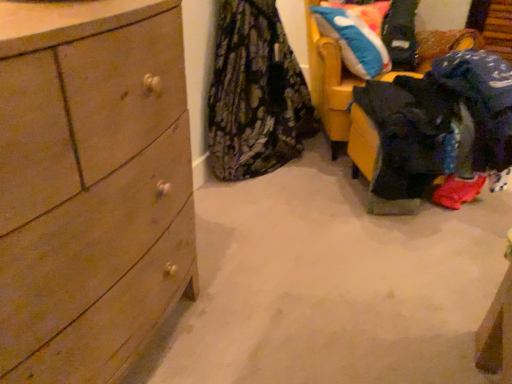
Question: Based on their sizes in the image, would you say dark blue fabric at lower right, the first clothing in the right-to-left sequence, is bigger or smaller than floral fabric skirt at center, the 1th clothing in the left-to-right sequence?

Choices:
 (A) big
 (B) small

Answer: (A)

Question: From the image's perspective, is dark blue fabric at lower right, the first clothing in the right-to-left sequence, above or below floral fabric skirt at center, the 1th clothing in the left-to-right sequence?

Choices:
 (A) above
 (B) below

Answer: (B)

Question: Estimate the real-world distances between objects in this image. Which object is closer to the blue plush pillow at upper right?

Choices:
 (A) wooden dresser at left
 (B) dark blue fabric at lower right, the first clothing in the right-to-left sequence
 (C) floral fabric skirt at center, the 1th clothing in the left-to-right sequence
 (D) yellow fabric chair at upper right

Answer: (D)

Question: Considering the real-world distances, which object is farthest from the dark blue fabric at lower right, which is the second clothing from left to right?

Choices:
 (A) yellow fabric chair at upper right
 (B) blue plush pillow at upper right
 (C) wooden dresser at left
 (D) floral fabric skirt at center, positioned as the 2th clothing in right-to-left order

Answer: (C)